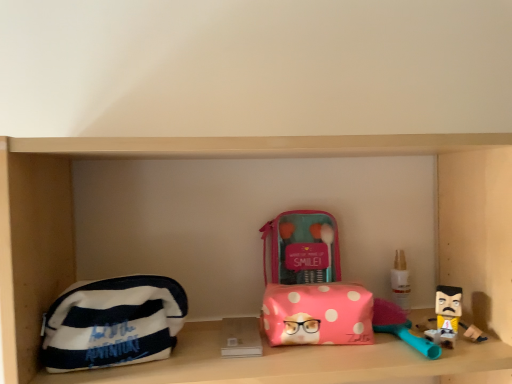
Question: From a real-world perspective, does pink polka dot pouch at center, which is the first pouch in right-to-left order, sit lower than white striped fabric pouch at left, the 1th pouch from the left?

Choices:
 (A) no
 (B) yes

Answer: (B)

Question: Is pink polka dot pouch at center, which is the first pouch in right-to-left order, behind white striped fabric pouch at left, the 1th pouch from the left?

Choices:
 (A) yes
 (B) no

Answer: (A)

Question: Can you confirm if pink polka dot pouch at center, which is the first pouch in right-to-left order, is smaller than white striped fabric pouch at left, the 1th pouch from the left?

Choices:
 (A) no
 (B) yes

Answer: (B)

Question: Could you tell me if pink polka dot pouch at center, which is the first pouch in right-to-left order, is facing white striped fabric pouch at left, the 1th pouch from the left?

Choices:
 (A) no
 (B) yes

Answer: (A)

Question: Is pink polka dot pouch at center, which ranks as the second pouch in left-to-right order, positioned with its back to white striped fabric pouch at left, the 1th pouch from the left?

Choices:
 (A) yes
 (B) no

Answer: (B)

Question: Is pink polka dot pouch at center, which is the first pouch in right-to-left order, at the right side of white striped fabric pouch at left, which ranks as the second pouch in right-to-left order?

Choices:
 (A) yes
 (B) no

Answer: (A)

Question: Considering the relative sizes of white plastic bottle at right and white striped fabric pouch at left, the 1th pouch from the left, in the image provided, is white plastic bottle at right taller than white striped fabric pouch at left, the 1th pouch from the left,?

Choices:
 (A) yes
 (B) no

Answer: (B)

Question: Does white plastic bottle at right have a lesser width compared to white striped fabric pouch at left, which ranks as the second pouch in right-to-left order?

Choices:
 (A) no
 (B) yes

Answer: (B)

Question: Is white plastic bottle at right wider than white striped fabric pouch at left, which ranks as the second pouch in right-to-left order?

Choices:
 (A) no
 (B) yes

Answer: (A)

Question: From a real-world perspective, is white plastic bottle at right located beneath white striped fabric pouch at left, the 1th pouch from the left?

Choices:
 (A) yes
 (B) no

Answer: (B)

Question: Is white plastic bottle at right outside of white striped fabric pouch at left, the 1th pouch from the left?

Choices:
 (A) no
 (B) yes

Answer: (B)

Question: Is white plastic bottle at right smaller than white striped fabric pouch at left, which ranks as the second pouch in right-to-left order?

Choices:
 (A) yes
 (B) no

Answer: (A)

Question: Would you say white plastic bottle at right is part of pink polka dot pouch at center, which ranks as the second pouch in left-to-right order,'s contents?

Choices:
 (A) no
 (B) yes

Answer: (A)